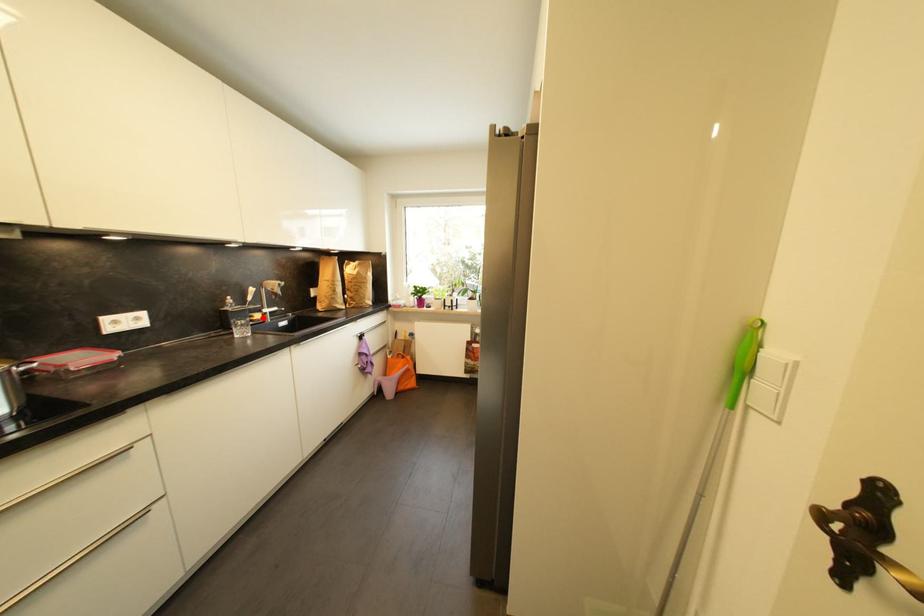
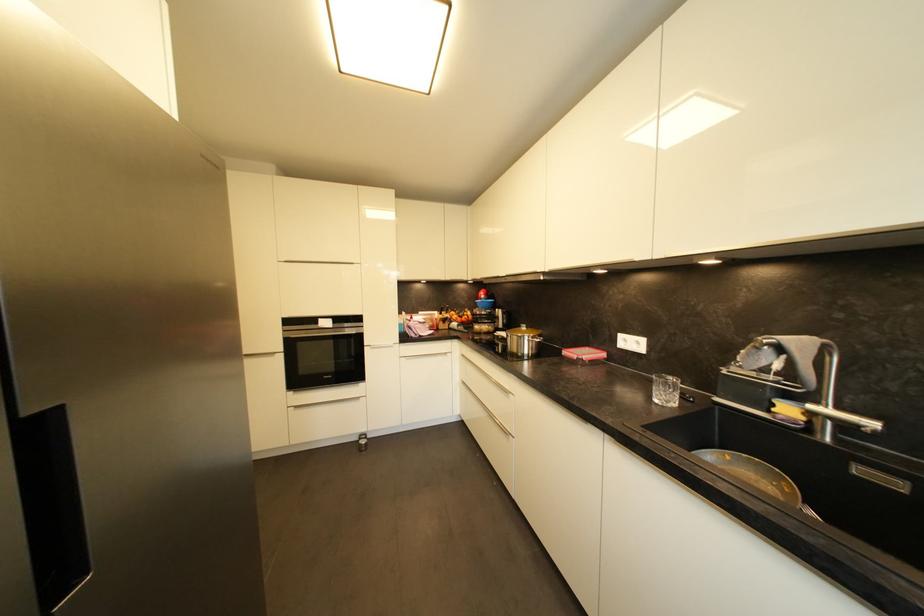
Find the pixel in the second image that matches the highlighted location in the first image.

(793, 411)